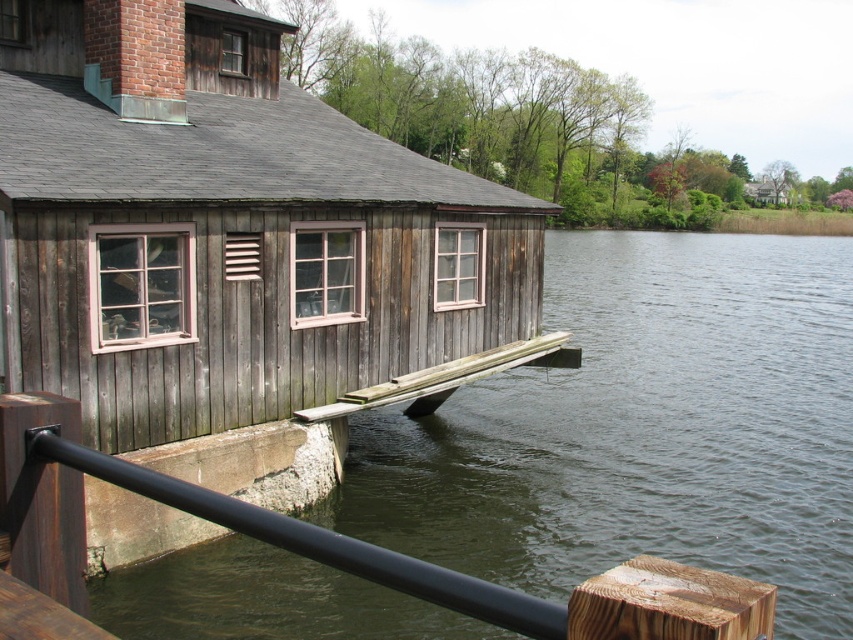
You are standing at the edge of the water near the boathouse and see two points marked on the wooden pier. The first point is at coordinates point (x=323, y=532) and the second is at point (x=315, y=406). If you were to walk towards the boathouse from the water, which point would you encounter first?

Point (x=323, y=532) is in front of point (x=315, y=406), so you would encounter point (x=323, y=532) first as you walk towards the boathouse from the water.